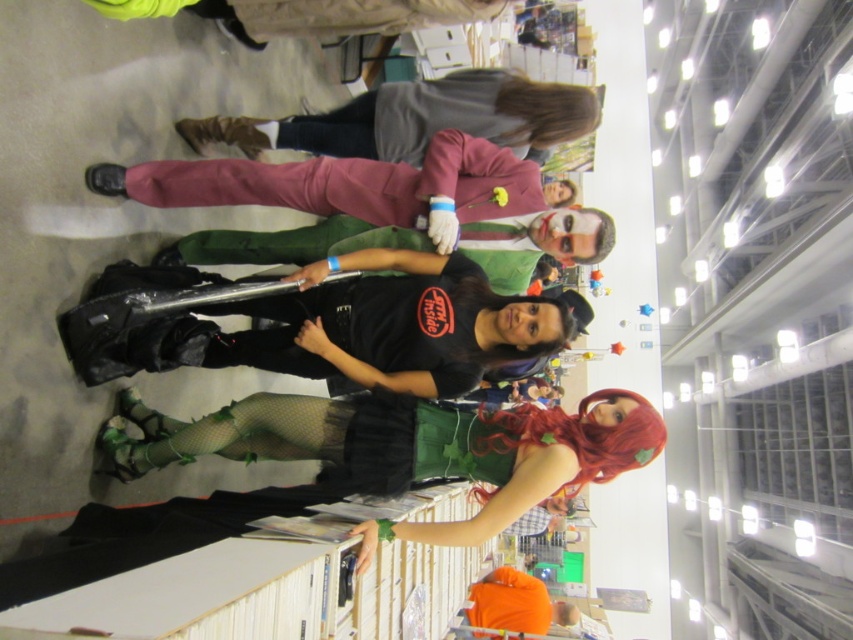
Who is taller, black matte t-shirt at center or matte gray sweater at upper center?

With more height is black matte t-shirt at center.

At what (x,y) coordinates should I click in order to perform the action: click on black matte t-shirt at center. Please return your answer as a coordinate pair (x, y). Looking at the image, I should click on (300, 324).

Is point (206, 333) closer to viewer compared to point (253, 150)?

Yes, point (206, 333) is in front of point (253, 150).

The width and height of the screenshot is (853, 640). Find the location of `black matte t-shirt at center`. black matte t-shirt at center is located at coordinates (300, 324).

Does green mesh stockings at center appear on the left side of black matte t-shirt at center?

In fact, green mesh stockings at center is to the right of black matte t-shirt at center.

Is point (120, 465) positioned in front of point (212, 291)?

Yes, point (120, 465) is closer to viewer.

Identify the location of green mesh stockings at center. click(x=408, y=449).

Is green mesh stockings at center to the left of matte gray sweater at upper center from the viewer's perspective?

Yes, green mesh stockings at center is to the left of matte gray sweater at upper center.

Does point (206, 451) come in front of point (432, 132)?

Yes, point (206, 451) is closer to viewer.

At what (x,y) coordinates should I click in order to perform the action: click on green mesh stockings at center. Please return your answer as a coordinate pair (x, y). The image size is (853, 640). Looking at the image, I should click on tap(408, 449).